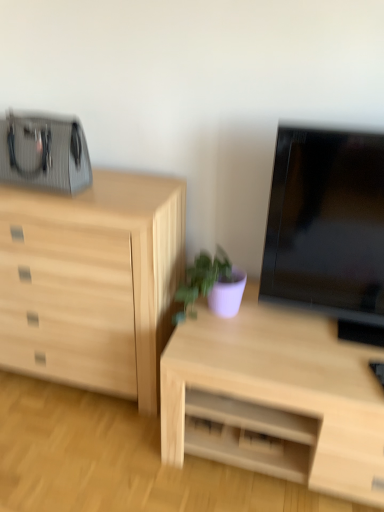
Locate an element on the screen. unoccupied area in front of purple matte plant at center is located at coordinates (223, 349).